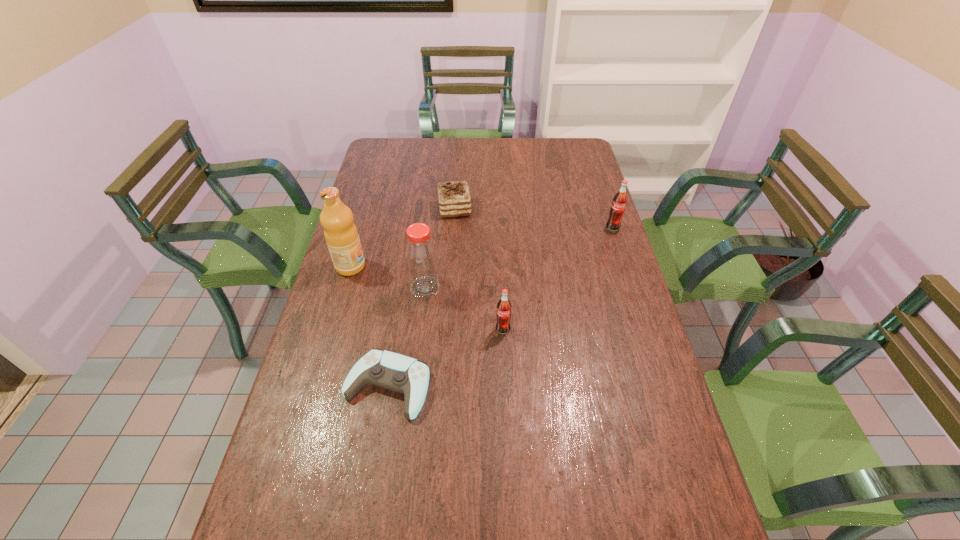
Where is `the fourth tallest object`? The image size is (960, 540). the fourth tallest object is located at coordinates (503, 313).

Find the location of `the fifth object from left to right`. the fifth object from left to right is located at coordinates (503, 313).

Find the location of a particular element. The image size is (960, 540). the fifth nearest object is located at coordinates (617, 209).

At what (x,y) coordinates should I click in order to perform the action: click on the taller soda bottle. Please return your answer as a coordinate pair (x, y). Image resolution: width=960 pixels, height=540 pixels. Looking at the image, I should click on (617, 209).

Locate an element on the screen. The image size is (960, 540). the farthest object is located at coordinates (454, 198).

Identify the location of chocolate cake. (454, 198).

Locate an element on the screen. bottle is located at coordinates (421, 257).

The height and width of the screenshot is (540, 960). Identify the location of the leftmost object. (341, 235).

Where is `the tallest object`? This screenshot has width=960, height=540. the tallest object is located at coordinates (341, 235).

Find the location of a particular element. control is located at coordinates (x=396, y=372).